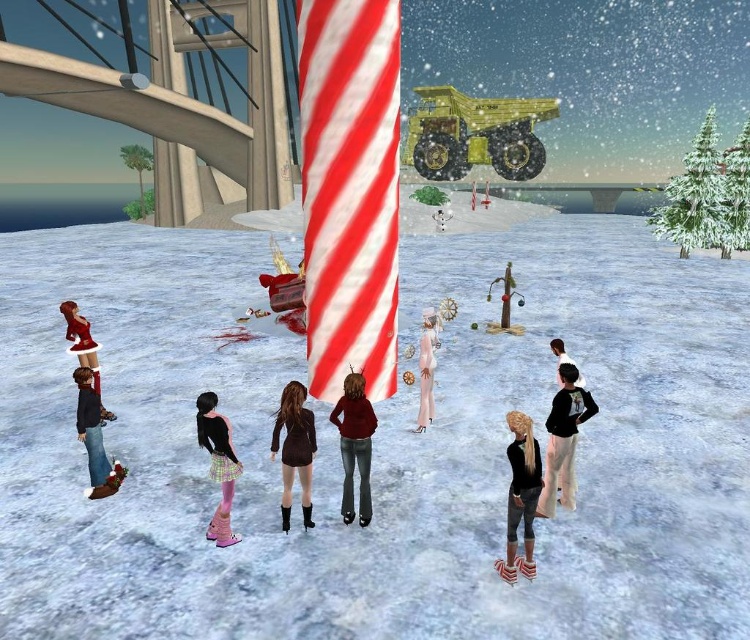
Does velvet maroon sweater at center have a greater height compared to denim jeans at lower left?

Yes, velvet maroon sweater at center is taller than denim jeans at lower left.

Is point (360, 412) farther from camera compared to point (90, 417)?

No, it is in front of (90, 417).

What are the coordinates of `velvet maroon sweater at center` in the screenshot? It's located at (354, 444).

Does velvet maroon sweater at center have a lesser width compared to pink satin skirt at lower center?

Indeed, velvet maroon sweater at center has a lesser width compared to pink satin skirt at lower center.

Is velvet maroon sweater at center bigger than pink satin skirt at lower center?

Correct, velvet maroon sweater at center is larger in size than pink satin skirt at lower center.

The width and height of the screenshot is (750, 640). Identify the location of velvet maroon sweater at center. (354, 444).

You are a GUI agent. You are given a task and a screenshot of the screen. Output one action in this format:
    pyautogui.click(x=<x>, y=<y>)
    Task: Click on the velvet maroon sweater at center
    This screenshot has width=750, height=640.
    Given the screenshot: What is the action you would take?
    click(354, 444)

Does white textured pants at lower right appear on the left side of pink satin skirt at lower center?

Incorrect, white textured pants at lower right is not on the left side of pink satin skirt at lower center.

Is point (537, 513) positioned in front of point (213, 454)?

No, it is not.

Is point (572, 484) behind point (206, 445)?

Yes.

You are a GUI agent. You are given a task and a screenshot of the screen. Output one action in this format:
    pyautogui.click(x=<x>, y=<y>)
    Task: Click on the white textured pants at lower right
    
    Given the screenshot: What is the action you would take?
    pyautogui.click(x=564, y=440)